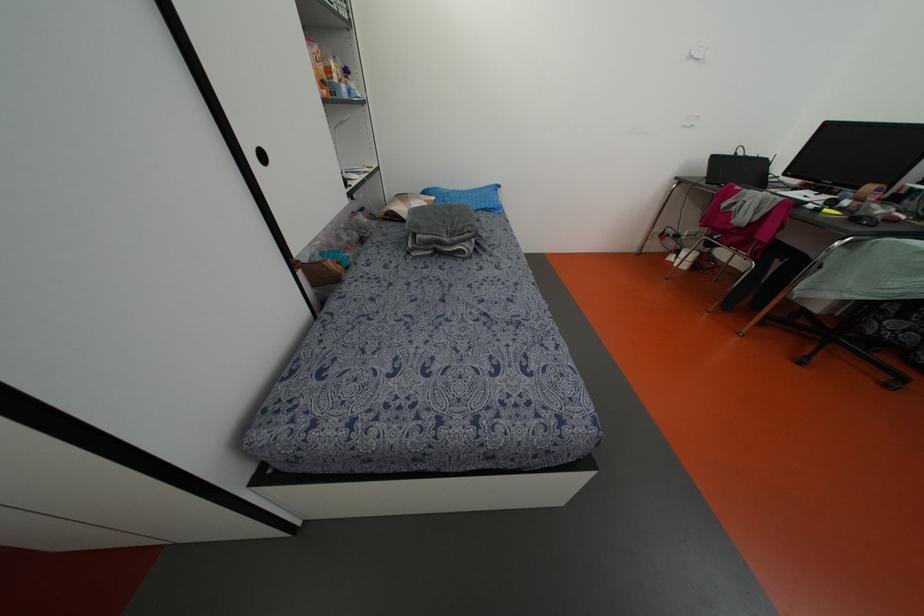
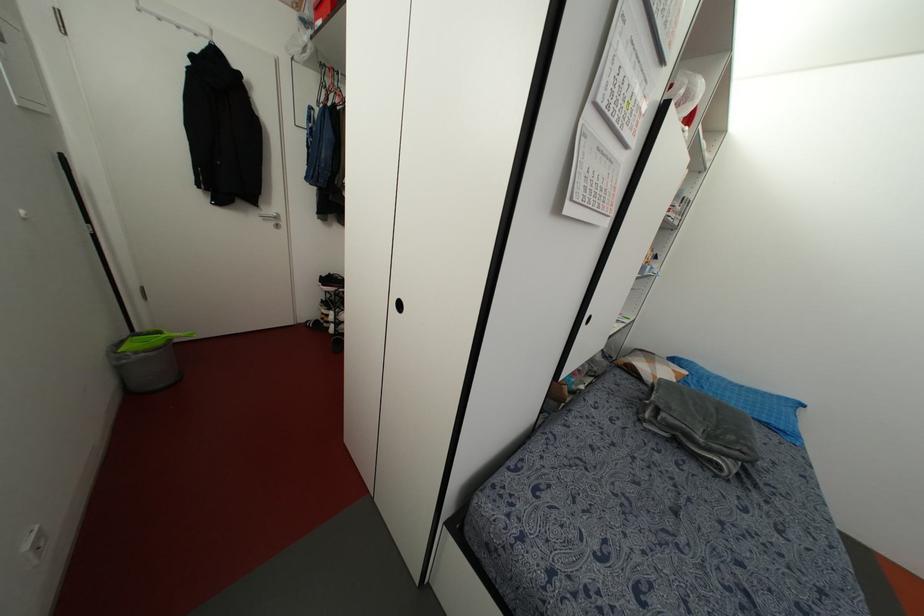
The point at (492,206) is marked in the first image. Where is the corresponding point in the second image?

(782, 427)